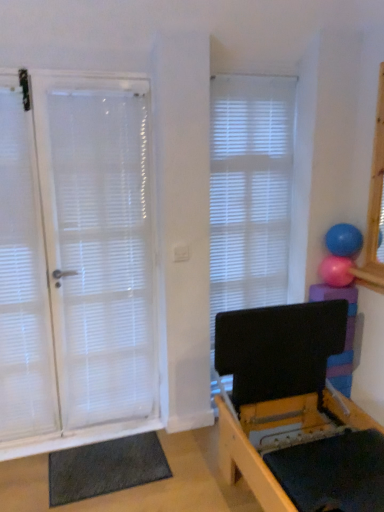
This screenshot has height=512, width=384. Describe the element at coordinates (23, 277) in the screenshot. I see `white sheer curtain at left` at that location.

Identify the location of white matte door at left. click(76, 262).

What do you see at coordinates (76, 262) in the screenshot? I see `white matte door at left` at bounding box center [76, 262].

This screenshot has height=512, width=384. Describe the element at coordinates (250, 191) in the screenshot. I see `white matte window blind at center` at that location.

Find the location of a particular element. This screenshot has height=512, width=384. blue rubber ball at upper right, positioned as the 2th ball in bottom-to-top order is located at coordinates (343, 240).

Is pink rubber ball at upper right, which is the 2th ball in top-to-bottom order, inside white sheer curtain at left?

That's incorrect, pink rubber ball at upper right, which is the 2th ball in top-to-bottom order, is not inside white sheer curtain at left.

Based on the photo, considering the positions of objects white sheer curtain at left and pink rubber ball at upper right, the 1th ball positioned from the bottom, in the image provided, who is more to the right, white sheer curtain at left or pink rubber ball at upper right, the 1th ball positioned from the bottom,?

pink rubber ball at upper right, the 1th ball positioned from the bottom.

Is white sheer curtain at left taller or shorter than pink rubber ball at upper right, which is the 2th ball in top-to-bottom order?

Considering their sizes, white sheer curtain at left has more height than pink rubber ball at upper right, which is the 2th ball in top-to-bottom order.

Could you tell me if white sheer curtain at left is facing pink rubber ball at upper right, the 1th ball positioned from the bottom?

No, white sheer curtain at left is not turned towards pink rubber ball at upper right, the 1th ball positioned from the bottom.

Which object is more forward, white sheer curtain at left or blue rubber ball at upper right, acting as the 1th ball starting from the top?

white sheer curtain at left is more forward.

Is white sheer curtain at left facing towards blue rubber ball at upper right, positioned as the 2th ball in bottom-to-top order?

No, white sheer curtain at left is not turned towards blue rubber ball at upper right, positioned as the 2th ball in bottom-to-top order.

From the image's perspective, would you say white sheer curtain at left is shown under blue rubber ball at upper right, acting as the 1th ball starting from the top?

Yes, from the image's perspective, white sheer curtain at left is below blue rubber ball at upper right, acting as the 1th ball starting from the top.

Is white sheer curtain at left not within blue rubber ball at upper right, positioned as the 2th ball in bottom-to-top order?

Yes, white sheer curtain at left is outside of blue rubber ball at upper right, positioned as the 2th ball in bottom-to-top order.

From a real-world perspective, is white matte door at left located higher than pink rubber ball at upper right, which is the 2th ball in top-to-bottom order?

Yes, from a real-world perspective, white matte door at left is above pink rubber ball at upper right, which is the 2th ball in top-to-bottom order.

Is white matte door at left taller or shorter than pink rubber ball at upper right, which is the 2th ball in top-to-bottom order?

white matte door at left is taller than pink rubber ball at upper right, which is the 2th ball in top-to-bottom order.

Where is `ball that is the 1st one when counting rightward from the white matte door at left`? ball that is the 1st one when counting rightward from the white matte door at left is located at coordinates (336, 271).

The width and height of the screenshot is (384, 512). I want to click on window blind lying on the left of blue rubber ball at upper right, acting as the 1th ball starting from the top, so click(x=250, y=191).

Is point (341, 230) farther from viewer compared to point (238, 221)?

No, (341, 230) is closer to viewer.

Would you consider blue rubber ball at upper right, positioned as the 2th ball in bottom-to-top order, to be distant from white matte window blind at center?

blue rubber ball at upper right, positioned as the 2th ball in bottom-to-top order, is actually quite close to white matte window blind at center.

From a real-world perspective, between blue rubber ball at upper right, acting as the 1th ball starting from the top, and white matte window blind at center, who is vertically higher?

blue rubber ball at upper right, acting as the 1th ball starting from the top, is physically above.

Is white matte door at left to the left or to the right of dark gray textured yoga mat at lower left in the image?

From the image, it's evident that white matte door at left is to the left of dark gray textured yoga mat at lower left.

In the image, is white matte door at left positioned in front of or behind dark gray textured yoga mat at lower left?

white matte door at left is positioned closer to the viewer than dark gray textured yoga mat at lower left.

In terms of width, does white matte door at left look wider or thinner when compared to dark gray textured yoga mat at lower left?

In the image, white matte door at left appears to be more narrow than dark gray textured yoga mat at lower left.

Which of these two, white sheer curtain at left or white matte door at left, is bigger?

white matte door at left.

Between white sheer curtain at left and white matte door at left, which one has smaller width?

white matte door at left is thinner.

From the image's perspective, between white sheer curtain at left and white matte door at left, which one is located above?

white matte door at left is shown above in the image.

I want to click on curtain located in front of the white matte door at left, so click(23, 277).

Is white matte door at left inside pink rubber ball at upper right, the 1th ball positioned from the bottom?

No, white matte door at left is not a part of pink rubber ball at upper right, the 1th ball positioned from the bottom.

Is point (323, 279) less distant than point (130, 343)?

Yes, it is in front of point (130, 343).

Is pink rubber ball at upper right, the 1th ball positioned from the bottom, directly adjacent to white matte door at left?

pink rubber ball at upper right, the 1th ball positioned from the bottom, is not next to white matte door at left, and they're not touching.

This screenshot has width=384, height=512. What are the coordinates of `curtain on the left of pink rubber ball at upper right, the 1th ball positioned from the bottom` in the screenshot? It's located at (23, 277).

You are a GUI agent. You are given a task and a screenshot of the screen. Output one action in this format:
    pyautogui.click(x=<x>, y=<y>)
    Task: Click on the ball above the white sheer curtain at left (from a real-world perspective)
    
    Given the screenshot: What is the action you would take?
    pyautogui.click(x=343, y=240)

Considering their positions, is blue rubber ball at upper right, acting as the 1th ball starting from the top, positioned further to dark gray textured yoga mat at lower left than pink rubber ball at upper right, which is the 2th ball in top-to-bottom order?

blue rubber ball at upper right, acting as the 1th ball starting from the top, lies further to dark gray textured yoga mat at lower left than the other object.

Estimate the real-world distances between objects in this image. Which object is closer to white matte window blind at center, pink rubber ball at upper right, the 1th ball positioned from the bottom, or white matte door at left?

pink rubber ball at upper right, the 1th ball positioned from the bottom, lies closer to white matte window blind at center than the other object.

From the picture: Which object lies further to the anchor point blue rubber ball at upper right, acting as the 1th ball starting from the top, white matte window blind at center or pink rubber ball at upper right, the 1th ball positioned from the bottom?

Based on the image, white matte window blind at center appears to be further to blue rubber ball at upper right, acting as the 1th ball starting from the top.

When comparing their distances from white matte door at left, does white sheer curtain at left or pink rubber ball at upper right, which is the 2th ball in top-to-bottom order, seem further?

pink rubber ball at upper right, which is the 2th ball in top-to-bottom order, is further to white matte door at left.

Which object lies nearer to the anchor point white sheer curtain at left, blue rubber ball at upper right, positioned as the 2th ball in bottom-to-top order, or white matte door at left?

white matte door at left is positioned closer to the anchor white sheer curtain at left.

Considering their positions, is pink rubber ball at upper right, the 1th ball positioned from the bottom, positioned closer to white matte door at left than white matte window blind at center?

Among the two, white matte window blind at center is located nearer to white matte door at left.

Considering their positions, is white matte door at left positioned closer to pink rubber ball at upper right, which is the 2th ball in top-to-bottom order, than blue rubber ball at upper right, acting as the 1th ball starting from the top?

blue rubber ball at upper right, acting as the 1th ball starting from the top, is closer to pink rubber ball at upper right, which is the 2th ball in top-to-bottom order.

Considering their positions, is blue rubber ball at upper right, acting as the 1th ball starting from the top, positioned further to pink rubber ball at upper right, which is the 2th ball in top-to-bottom order, than dark gray textured yoga mat at lower left?

dark gray textured yoga mat at lower left is further to pink rubber ball at upper right, which is the 2th ball in top-to-bottom order.

Where is `ball situated between white sheer curtain at left and blue rubber ball at upper right, positioned as the 2th ball in bottom-to-top order, from left to right`? This screenshot has width=384, height=512. ball situated between white sheer curtain at left and blue rubber ball at upper right, positioned as the 2th ball in bottom-to-top order, from left to right is located at coordinates (336, 271).

You are a GUI agent. You are given a task and a screenshot of the screen. Output one action in this format:
    pyautogui.click(x=<x>, y=<y>)
    Task: Click on the yoga mat between white sheer curtain at left and blue rubber ball at upper right, acting as the 1th ball starting from the top
    
    Given the screenshot: What is the action you would take?
    pyautogui.click(x=105, y=468)

The image size is (384, 512). Find the location of `yoga mat located between white matte door at left and blue rubber ball at upper right, acting as the 1th ball starting from the top, in the left-right direction`. yoga mat located between white matte door at left and blue rubber ball at upper right, acting as the 1th ball starting from the top, in the left-right direction is located at coordinates (105, 468).

In order to click on yoga mat between white matte door at left and pink rubber ball at upper right, the 1th ball positioned from the bottom, from left to right in this screenshot , I will do `click(105, 468)`.